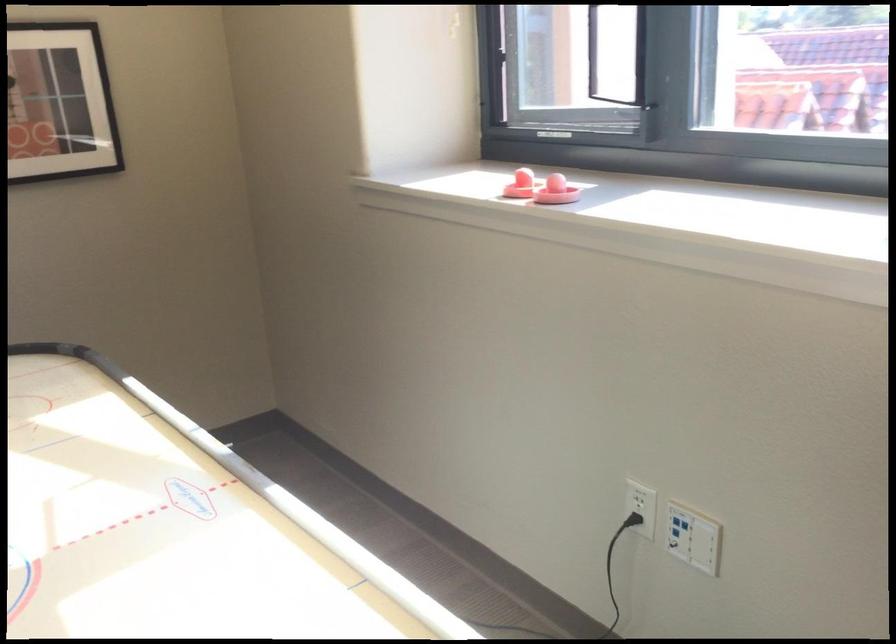
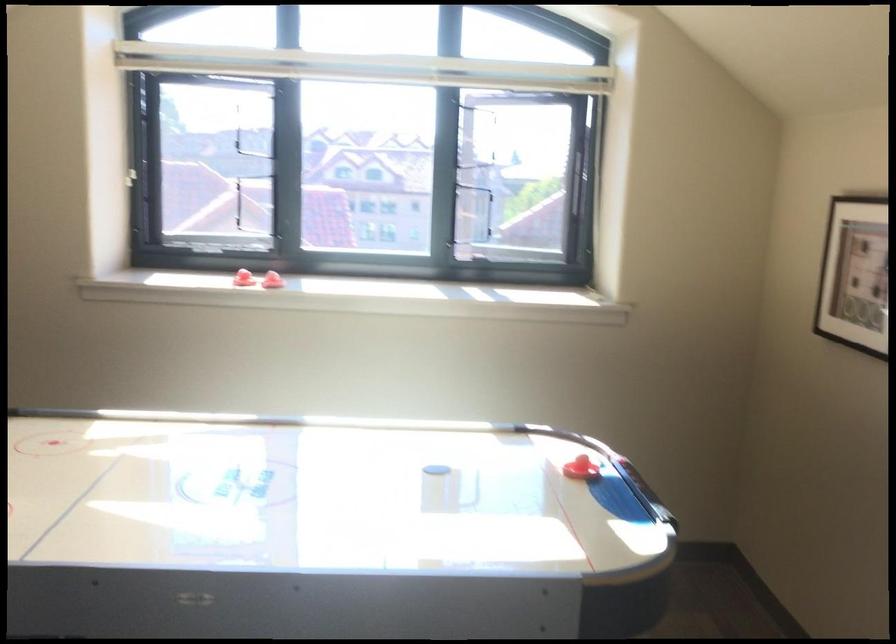
The point at (616, 192) is marked in the first image. Where is the corresponding point in the second image?

(271, 279)